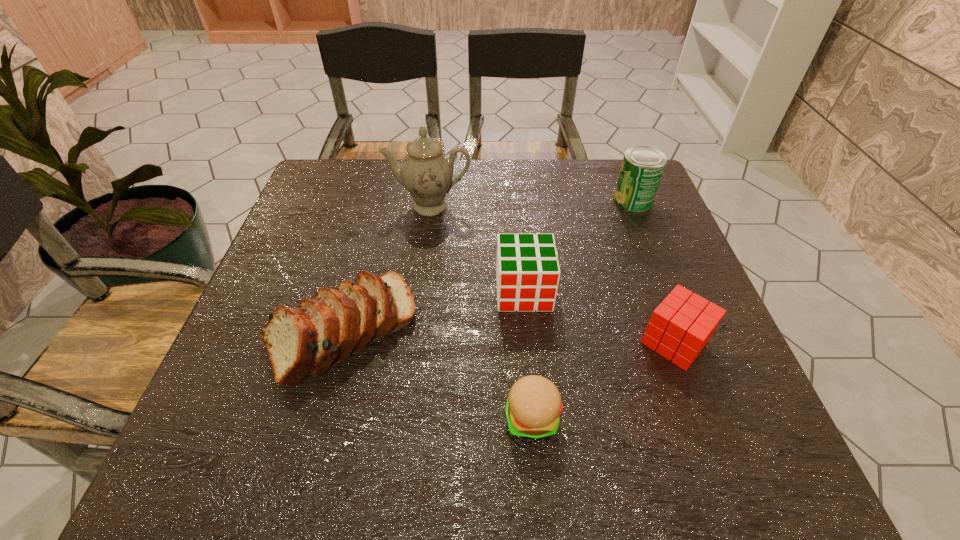
Locate an element on the screen. unoccupied position between the left cube and the can is located at coordinates (578, 246).

You are a GUI agent. You are given a task and a screenshot of the screen. Output one action in this format:
    pyautogui.click(x=<x>, y=<y>)
    Task: Click on the free space between the bread and the shortest object
    The height and width of the screenshot is (540, 960).
    Given the screenshot: What is the action you would take?
    pyautogui.click(x=438, y=373)

Find the location of a particular element. This screenshot has width=960, height=540. free space that is in between the shortest object and the taller cube is located at coordinates (528, 354).

This screenshot has width=960, height=540. Identify the location of free spot between the nearer cube and the can. (654, 271).

What are the coordinates of `empty space that is in between the can and the right cube` in the screenshot? It's located at (654, 271).

The width and height of the screenshot is (960, 540). In order to click on vacant region between the tallest object and the left cube in this screenshot , I will do `click(477, 249)`.

Image resolution: width=960 pixels, height=540 pixels. Identify the location of vacant area that lies between the nearest object and the taller cube. (528, 354).

The width and height of the screenshot is (960, 540). I want to click on the fifth closest object to the nearer cube, so click(x=426, y=171).

Select which object appears as the third closest to the bread. Please provide its 2D coordinates. Your answer should be formatted as a tuple, i.e. [(x, y)], where the tuple contains the x and y coordinates of a point satisfying the conditions above.

[(426, 171)]

Find the location of `free space that satisfies the following two spatial constraints: 1. on the red face of the nearer cube; 2. on the left side of the left cube`. free space that satisfies the following two spatial constraints: 1. on the red face of the nearer cube; 2. on the left side of the left cube is located at coordinates (528, 342).